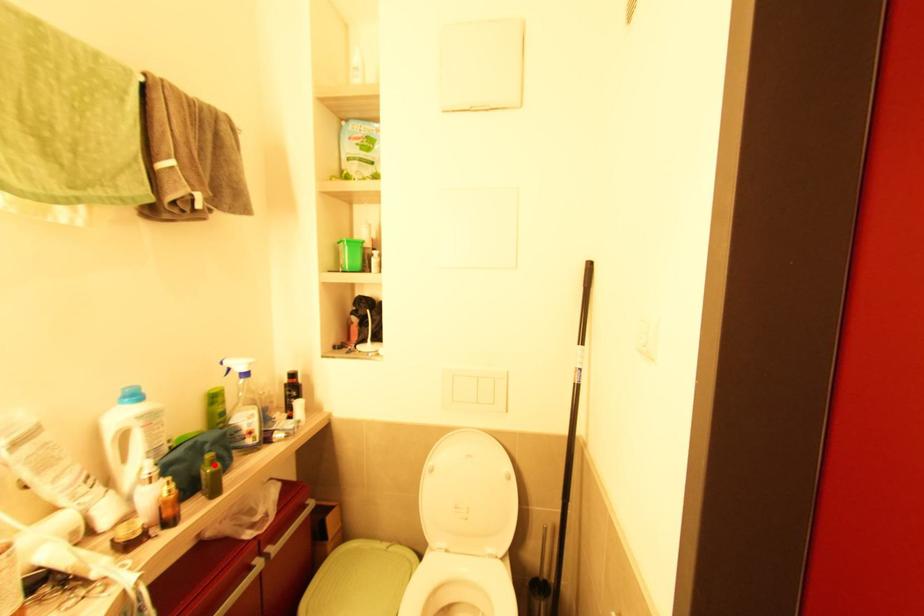
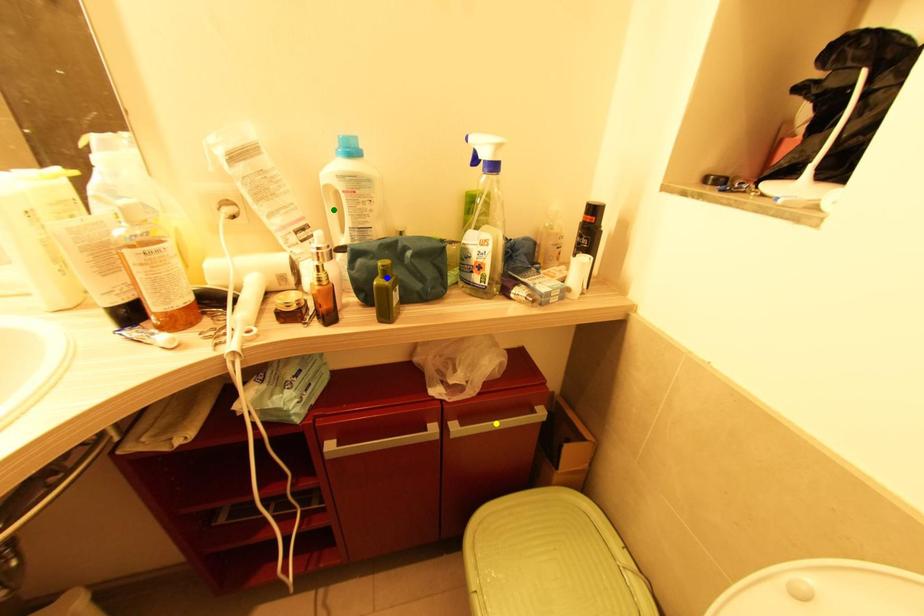
Question: I am providing you with two images of the same scene from different viewpoints. A red point is marked on the first image. You are given multiple points on the second image. Which point in image 2 represents the same 3d spot as the red point in image 1?

Choices:
 (A) blue point
 (B) green point
 (C) yellow point

Answer: (A)